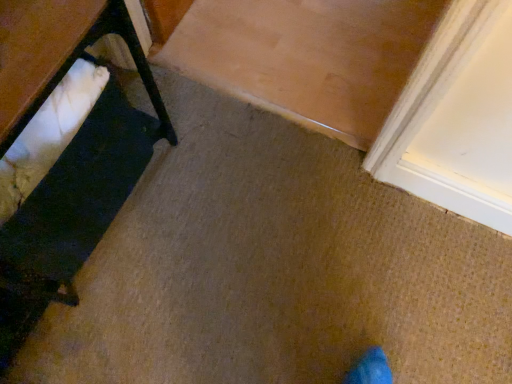
Question: Does white fabric cushion at left have a greater height compared to white fabric at left?

Choices:
 (A) yes
 (B) no

Answer: (A)

Question: Is white fabric cushion at left facing towards white fabric at left?

Choices:
 (A) yes
 (B) no

Answer: (B)

Question: Considering the relative positions of white fabric cushion at left and white fabric at left in the image provided, is white fabric cushion at left to the left of white fabric at left from the viewer's perspective?

Choices:
 (A) yes
 (B) no

Answer: (B)

Question: Are white fabric cushion at left and white fabric at left beside each other?

Choices:
 (A) no
 (B) yes

Answer: (A)

Question: Can you confirm if white fabric cushion at left is wider than white fabric at left?

Choices:
 (A) no
 (B) yes

Answer: (A)

Question: From a real-world perspective, does white fabric cushion at left sit lower than white fabric at left?

Choices:
 (A) no
 (B) yes

Answer: (B)

Question: Does white fabric at left have a greater height compared to white fabric cushion at left?

Choices:
 (A) yes
 (B) no

Answer: (B)

Question: From a real-world perspective, is white fabric at left located higher than white fabric cushion at left?

Choices:
 (A) yes
 (B) no

Answer: (A)

Question: Is white fabric at left to the left of white fabric cushion at left from the viewer's perspective?

Choices:
 (A) no
 (B) yes

Answer: (B)

Question: From a real-world perspective, is white fabric at left located beneath white fabric cushion at left?

Choices:
 (A) no
 (B) yes

Answer: (A)

Question: Can you confirm if white fabric at left is wider than white fabric cushion at left?

Choices:
 (A) no
 (B) yes

Answer: (B)

Question: Can we say white fabric at left lies outside white fabric cushion at left?

Choices:
 (A) no
 (B) yes

Answer: (A)

Question: Based on their positions, is white fabric at left located to the left or right of white fabric cushion at left?

Choices:
 (A) left
 (B) right

Answer: (A)